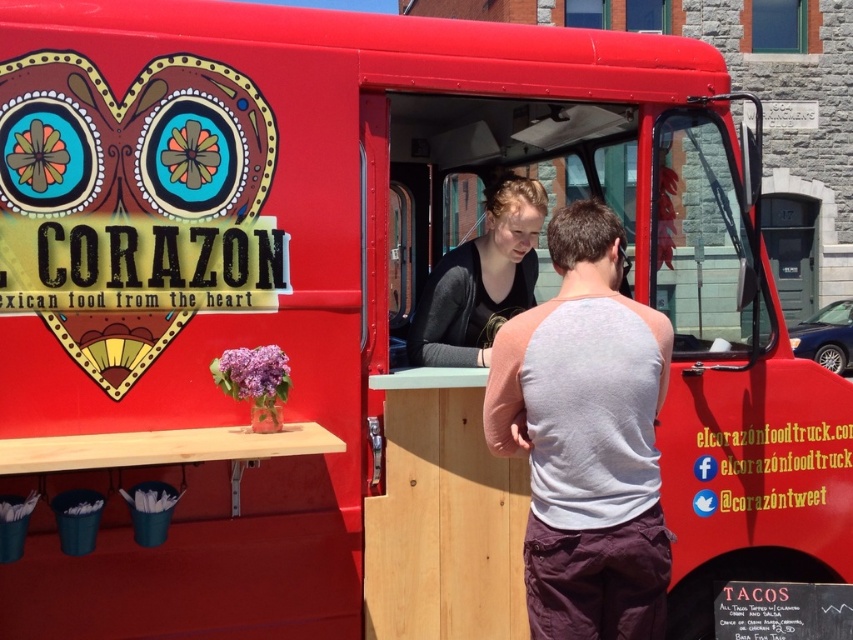
Is gray fabric tank top at center positioned at the back of matte black shirt at center?

No, it is in front of matte black shirt at center.

Between point (642, 413) and point (509, 268), which one is positioned in front?

Point (642, 413) is in front.

Find the location of a particular element. The width and height of the screenshot is (853, 640). gray fabric tank top at center is located at coordinates (585, 438).